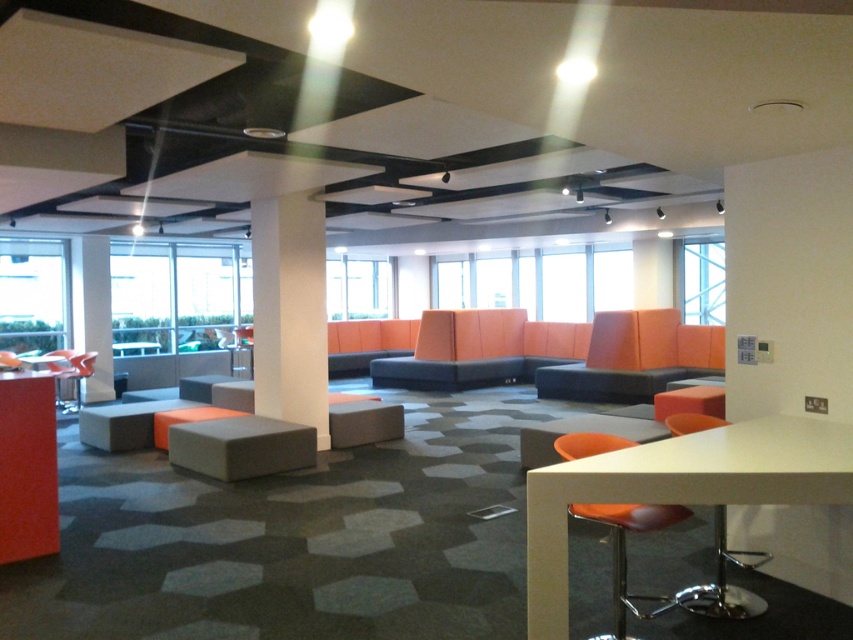
Is orange fabric couch at center closer to camera compared to white glossy pillar at center?

Yes, orange fabric couch at center is in front of white glossy pillar at center.

Which is in front, point (642, 387) or point (102, 252)?

Positioned in front is point (642, 387).

Identify the location of orange fabric couch at center. (634, 356).

Is white glossy table at lower right positioned behind matte gray bar stool at center?

That is False.

The height and width of the screenshot is (640, 853). What do you see at coordinates (680, 488) in the screenshot?
I see `white glossy table at lower right` at bounding box center [680, 488].

The image size is (853, 640). What are the coordinates of `white glossy table at lower right` in the screenshot? It's located at (680, 488).

Between white smooth pillar at center and orange fabric couch at center, which one appears on the left side from the viewer's perspective?

From the viewer's perspective, white smooth pillar at center appears more on the left side.

Which of these two, white smooth pillar at center or orange fabric couch at center, stands shorter?

Standing shorter between the two is orange fabric couch at center.

Measure the distance between point (318, 205) and camera.

The distance of point (318, 205) from camera is 7.13 meters.

Where is `white smooth pillar at center`? white smooth pillar at center is located at coordinates (289, 310).